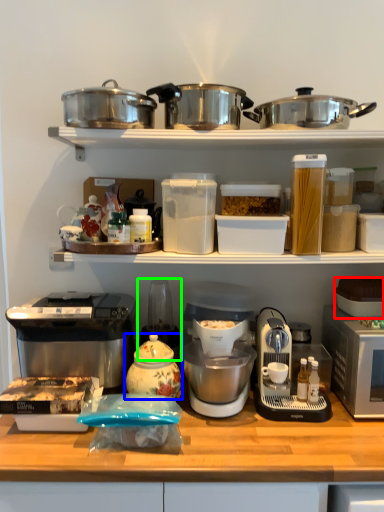
Question: Which object is positioned closest to appliance (highlighted by a red box)? Select from kitchen appliance (highlighted by a blue box) and appliance (highlighted by a green box).

Choices:
 (A) kitchen appliance
 (B) appliance

Answer: (B)